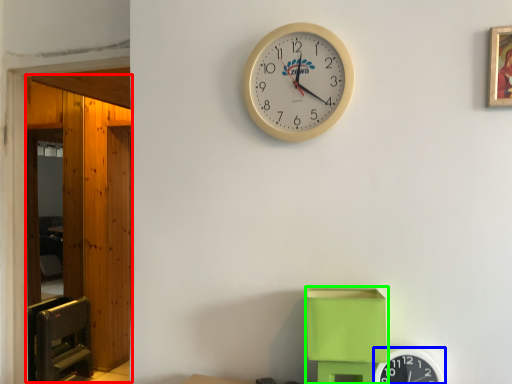
Question: Considering the real-world distances, which object is closest to glass door (highlighted by a red box)? wall clock (highlighted by a blue box) or toy (highlighted by a green box).

Choices:
 (A) wall clock
 (B) toy

Answer: (B)